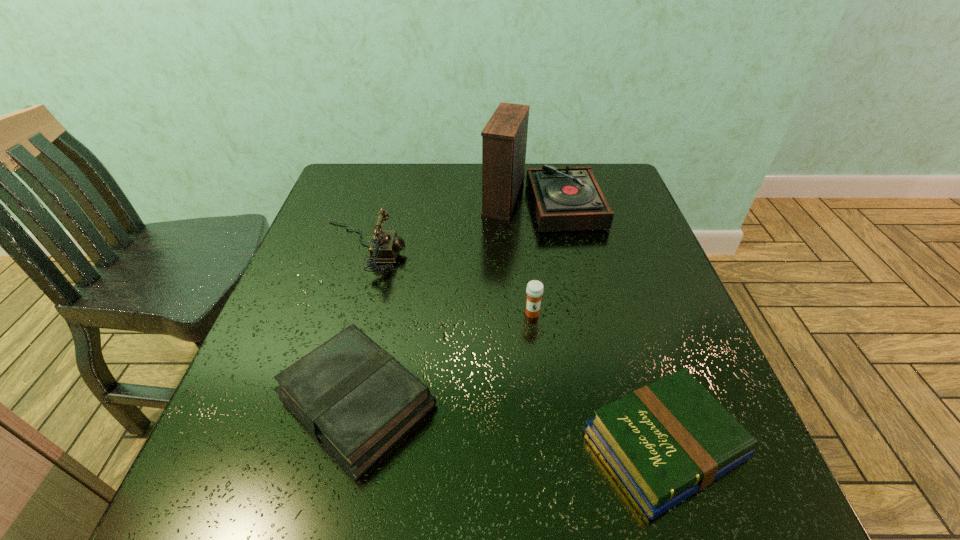
The width and height of the screenshot is (960, 540). I want to click on blank area located 0.360m on the left of the right book, so click(x=365, y=444).

This screenshot has height=540, width=960. Find the location of `object at the far edge`. object at the far edge is located at coordinates (567, 198).

Image resolution: width=960 pixels, height=540 pixels. In order to click on telephone that is at the left edge in this screenshot , I will do pyautogui.click(x=384, y=247).

At what (x,y) coordinates should I click in order to perform the action: click on book situated at the left edge. Please return your answer as a coordinate pair (x, y). The image size is (960, 540). Looking at the image, I should click on (356, 399).

Locate an element on the screen. This screenshot has width=960, height=540. phonograph record located at the right edge is located at coordinates (567, 198).

At what (x,y) coordinates should I click in order to perform the action: click on book present at the right edge. Please return your answer as a coordinate pair (x, y). The height and width of the screenshot is (540, 960). Looking at the image, I should click on (666, 441).

Where is `object located at the near left corner`? The image size is (960, 540). object located at the near left corner is located at coordinates (356, 399).

At what (x,y) coordinates should I click in order to perform the action: click on object that is positioned at the far right corner. Please return your answer as a coordinate pair (x, y). Looking at the image, I should click on (567, 198).

Find the location of a particular element. object present at the near right corner is located at coordinates (666, 441).

Find the location of a particular element. This screenshot has height=540, width=960. free space at the far edge of the desktop is located at coordinates click(410, 173).